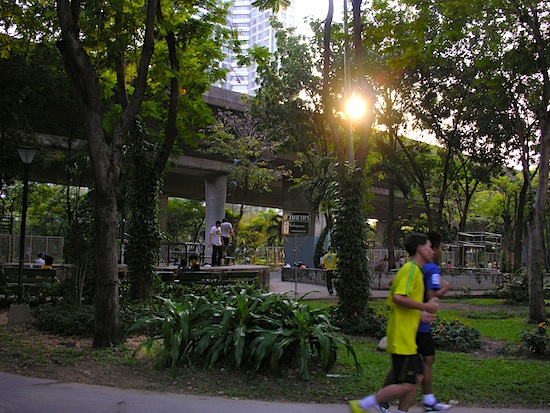
Locate an element on the screen. The height and width of the screenshot is (413, 550). benches is located at coordinates (26, 278), (202, 280), (231, 279), (167, 281).